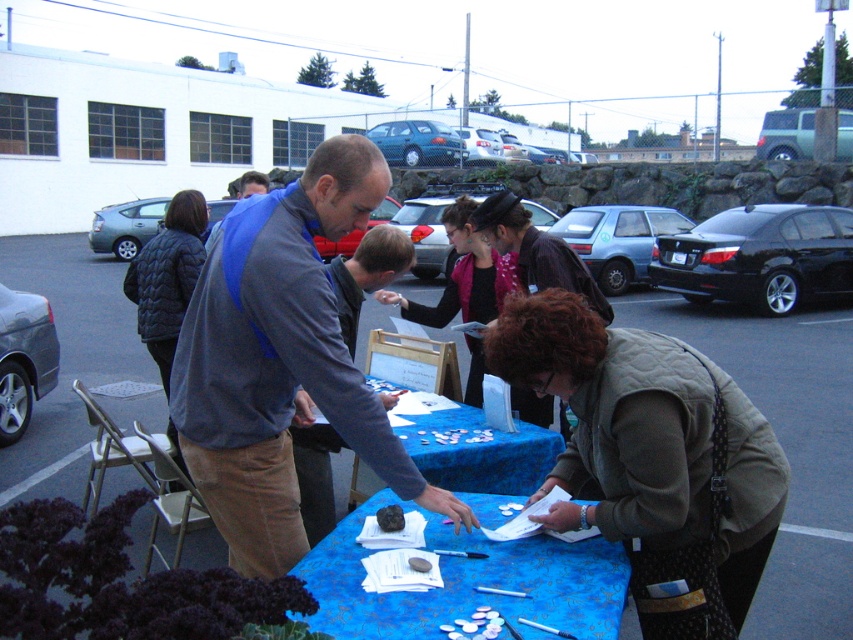
You are a photographer at the event and want to capture a photo of both the matte black vest at center and the matte gray jacket at center. In the photo, which one should be placed to the left to ensure both are visible?

The matte gray jacket at center should be placed to the left so that the matte black vest at center is on its right side, ensuring both are visible in the photo.

You are standing at the point with coordinates point (463, 275) in the image. What object are you standing on?

The point (463, 275) is on the matte black vest at center.

You are a participant at the event and need to locate the blue fabric vest at center and the blue fabric tablecloth at center. According to the scene, which one is positioned to the left?

The blue fabric vest at center is positioned on the left side of the blue fabric tablecloth at center, so the blue fabric vest at center is to the left.